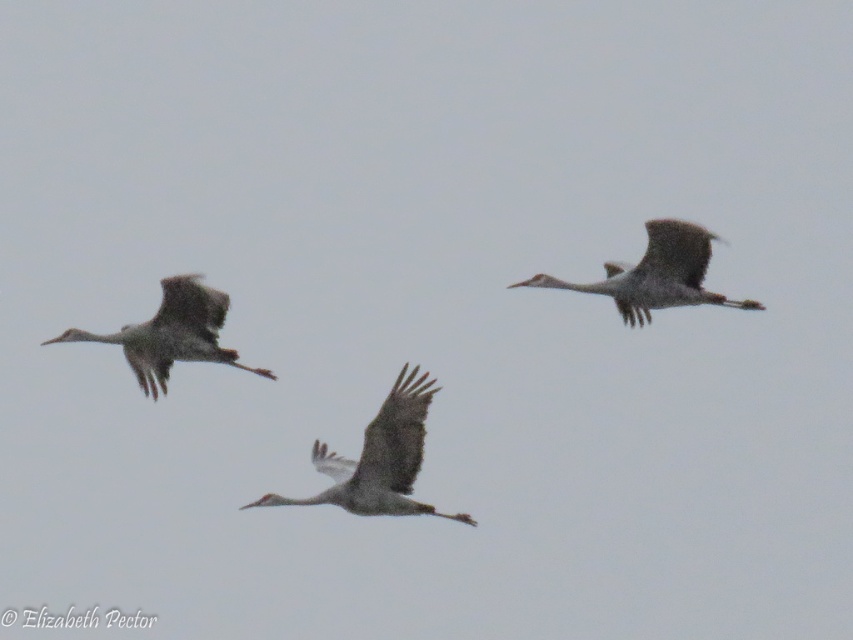
You are a wildlife photographer aiming to capture the gray feathered crane at center. The camera you are using has a focus point at coordinate point [378,460]. Will this focus point help you capture the crane?

The point [378,460] marks the gray feathered crane at center, so yes, the focus point at this coordinate will help capture the crane.

You are standing at a location where you want to photograph the gray feathered crane at left. If the crane is 28.62 meters away from you, and you have a camera with a 50mm lens, will the crane fill the frame adequately for a closeup? Assume the crane is 1 meter in height and the camera sensor is 24mm height.

The gray feathered crane at left is 28.62 meters away. Using the formula for angular size, the height of the crane in the frame would be approximately 0.8 degrees, which is too small to fill the frame adequately for a closeup with a 50mm lens and 24mm sensor height.